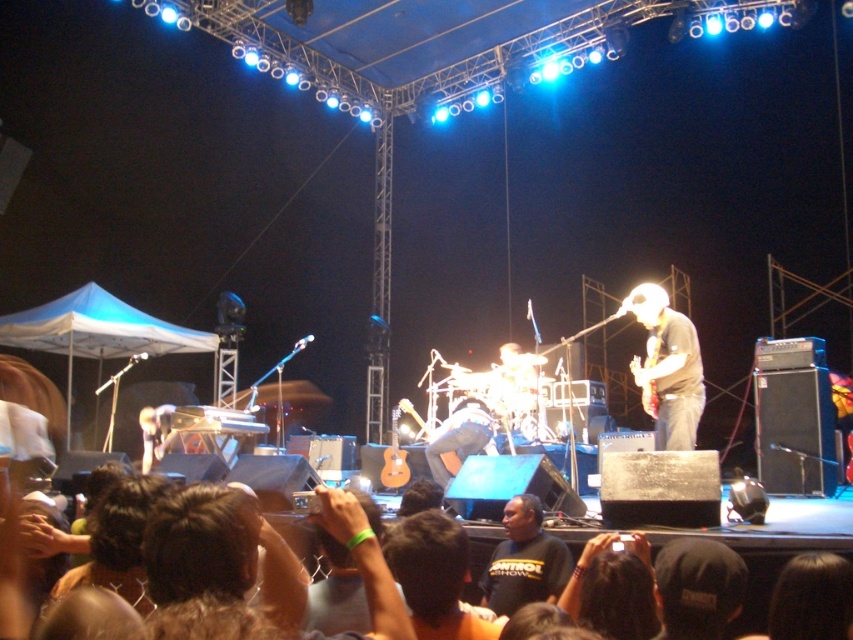
What do you see at coordinates (666, 368) in the screenshot? I see `matte black guitar at center` at bounding box center [666, 368].

Is point (660, 397) farther from viewer compared to point (520, 602)?

Yes, point (660, 397) is farther from viewer.

Where is `matte black guitar at center`? matte black guitar at center is located at coordinates [666, 368].